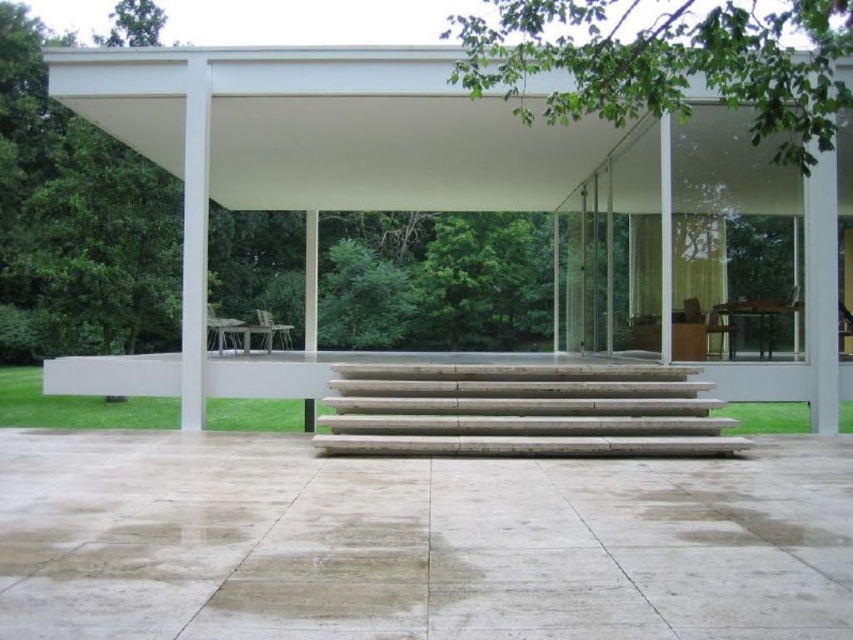
From the picture: You are standing in front of the modern architectural structure and want to enter through the entrance. Which direction should you walk relative to the white concrete pergola at center to reach the smooth concrete steps at center?

You should walk to the right side of the white concrete pergola at center to reach the smooth concrete steps at center because the smooth concrete steps at center is positioned on the right side of white concrete pergola at center.

You are standing at the entrance of the structure and want to walk towards the white concrete pergola at center. Which direction should you move relative to the smooth concrete steps at center?

You should move away from the smooth concrete steps at center towards the white concrete pergola at center since the steps are closer to you than the pergola.

You are planning to install a new pathway between the smooth concrete steps at center and the white marble stairs at center. Given that the pathway must be placed in the middle between them, which staircase should the pathway be closer to and why?

The pathway should be closer to the white marble stairs at center because the smooth concrete steps at center is wider than the white marble stairs at center, so the midpoint between them would be nearer to the narrower staircase.